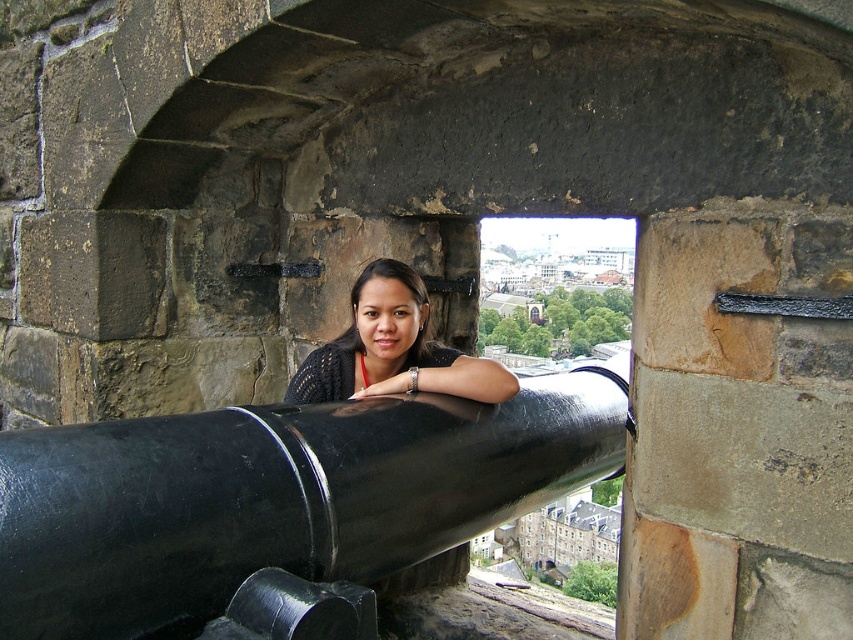
Question: Which of the following is the closest to the observer?

Choices:
 (A) (474, 448)
 (B) (457, 353)

Answer: (A)

Question: Is black polished cannon at center closer to the viewer compared to matte black sweater at center?

Choices:
 (A) yes
 (B) no

Answer: (A)

Question: Can you confirm if black polished cannon at center is positioned to the left of matte black sweater at center?

Choices:
 (A) no
 (B) yes

Answer: (A)

Question: Does black polished cannon at center have a smaller size compared to matte black sweater at center?

Choices:
 (A) yes
 (B) no

Answer: (B)